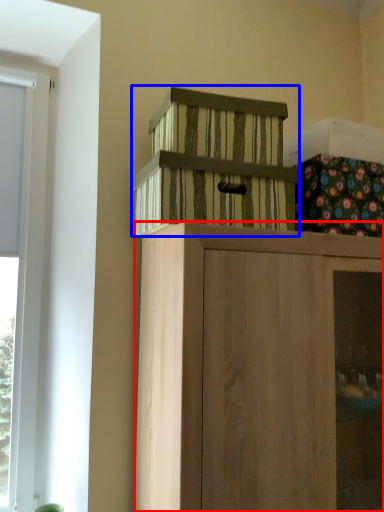
Question: Which object appears farthest to the camera in this image, cabinetry (highlighted by a red box) or cabinetry (highlighted by a blue box)?

Choices:
 (A) cabinetry
 (B) cabinetry

Answer: (B)